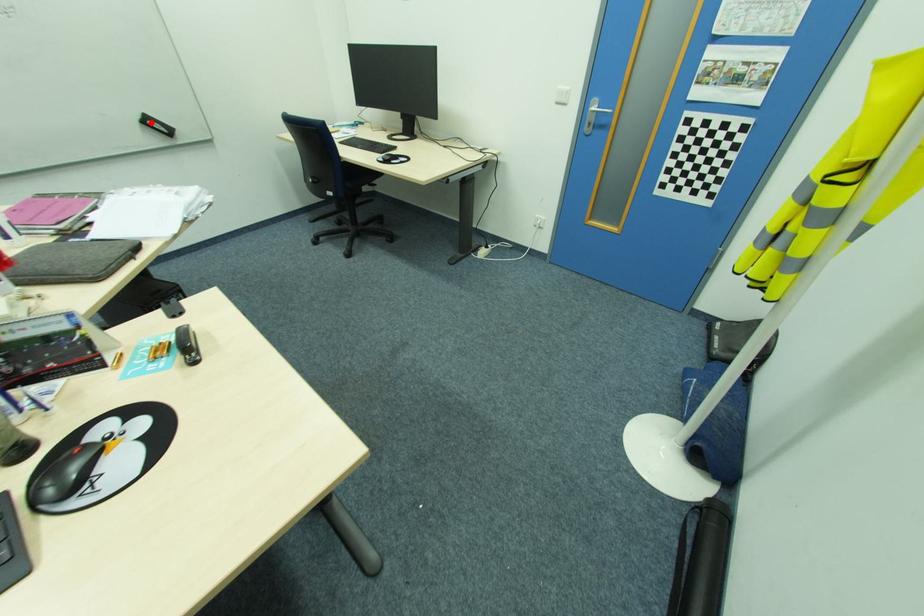
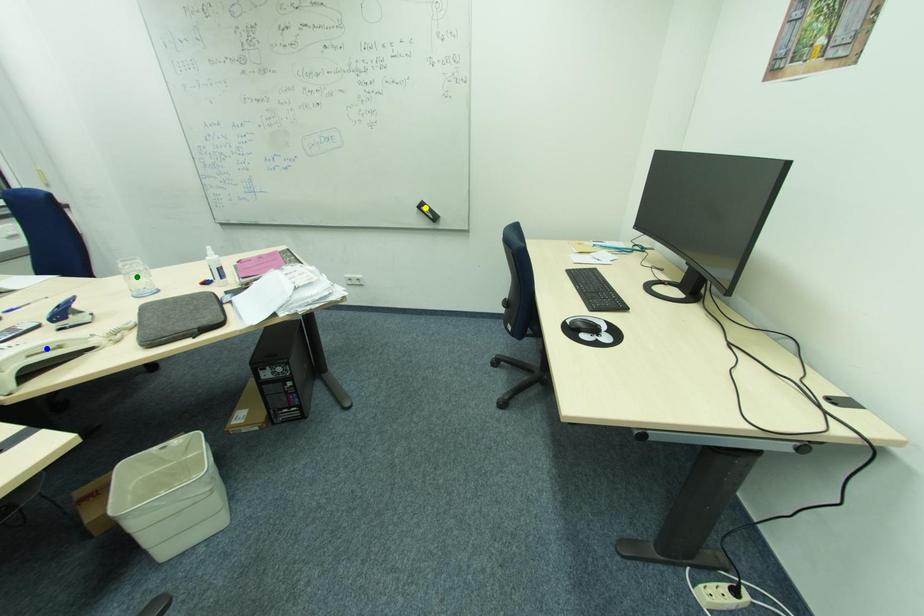
Question: I am providing you with two images of the same scene from different viewpoints. A red point is marked on the first image. You are given multiple points on the second image. In image 2, which mark is for the same physical point as the one in image 1?

Choices:
 (A) green point
 (B) yellow point
 (C) blue point

Answer: (B)